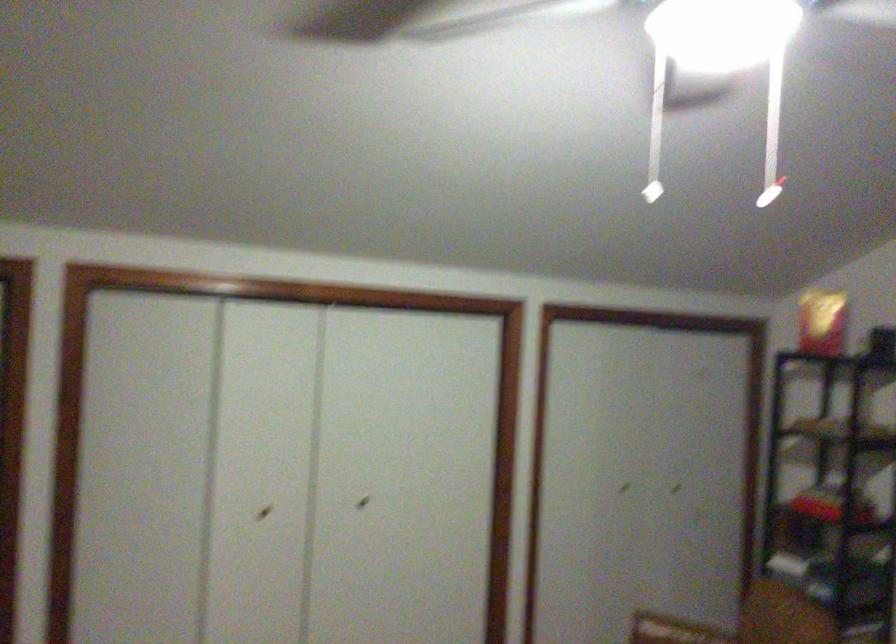
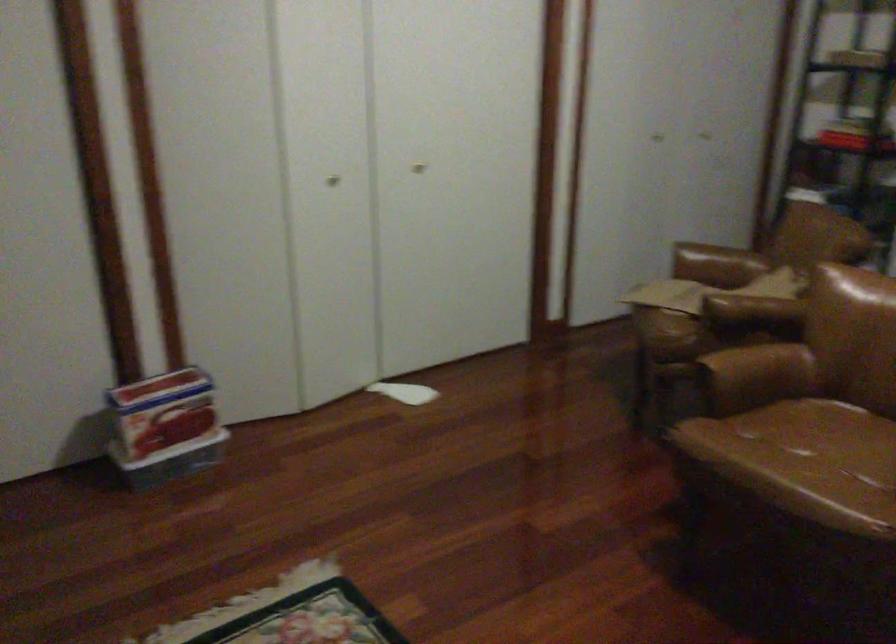
Question: How did the camera likely rotate?

Choices:
 (A) Left
 (B) Right
 (C) Up
 (D) Down

Answer: (D)